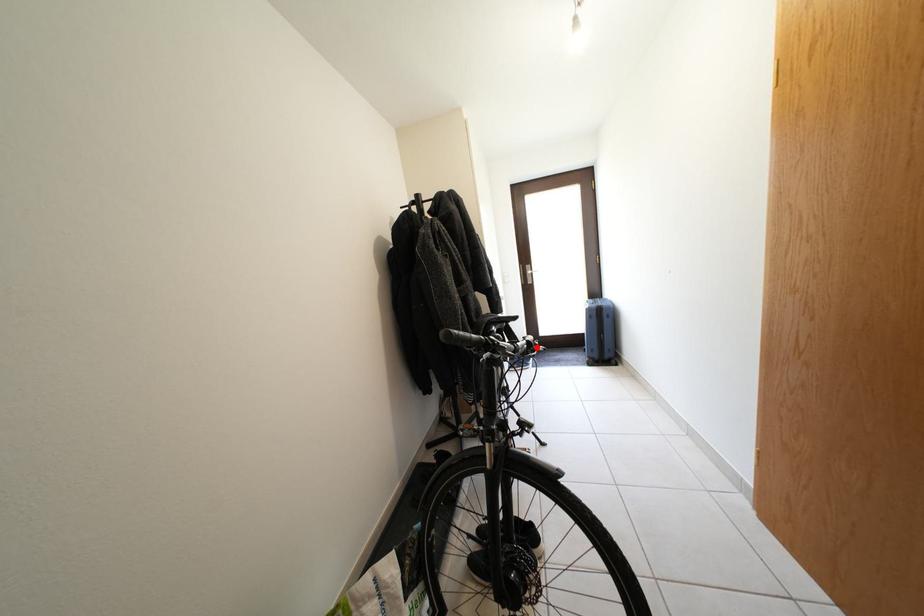
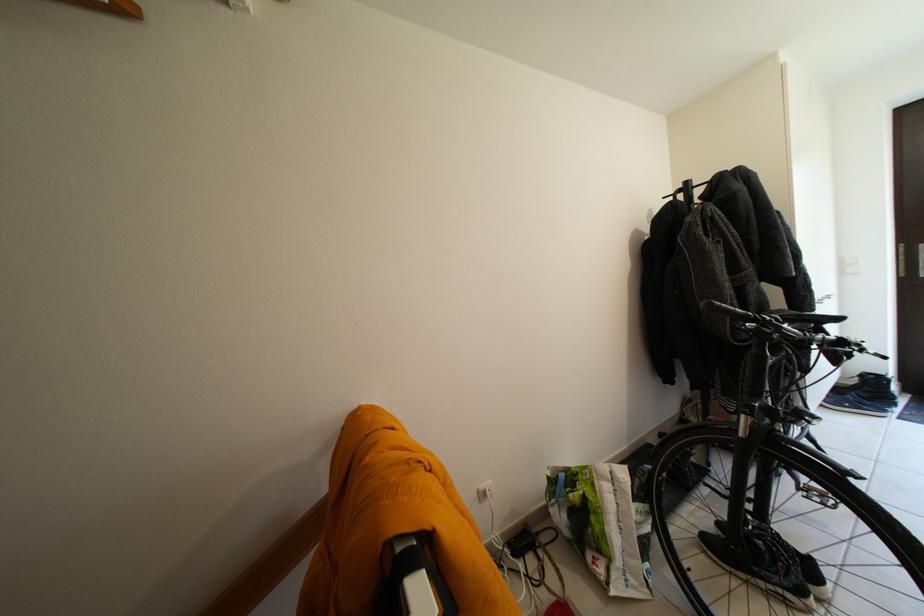
Question: I am providing you with two images of the same scene from different viewpoints. Image1 has a red point marked. In image2, the corresponding 3D location appears at what relative position? Reply with the corresponding letter.

Choices:
 (A) Closer
 (B) Farther

Answer: (A)